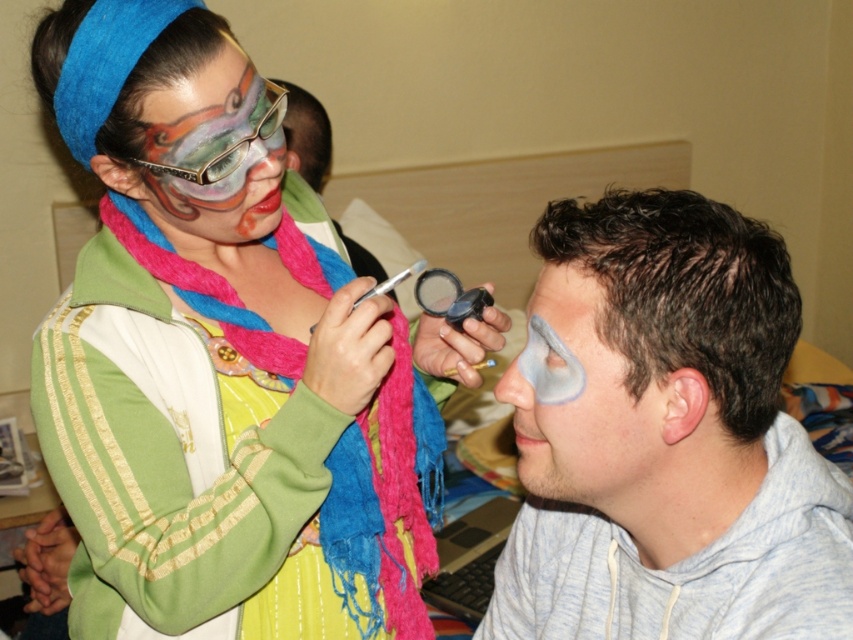
You are a makeup artist who needs to reach both the multicolored painted face at upper left and the matte black face paint at upper center. Given that your arm can extend 1 meter, can you comfortably reach both items without moving your position?

The multicolored painted face at upper left and the matte black face paint at upper center are 1.11 meters apart. Since your arm can only extend 1 meter, you cannot comfortably reach both items without moving your position.

You are a photographer standing in front of the scene. You want to take a photo that includes both the matte multicolored scarf at upper left and the matte gray face paint at right. Given that your camera has a maximum focus range of 12 inches, will you be able to capture both objects in focus without moving closer?

The matte multicolored scarf at upper left and matte gray face paint at right are 13.17 inches apart, which exceeds the camera maximum focus range of 12 inches. Therefore, you cannot capture both objects in focus without moving closer.